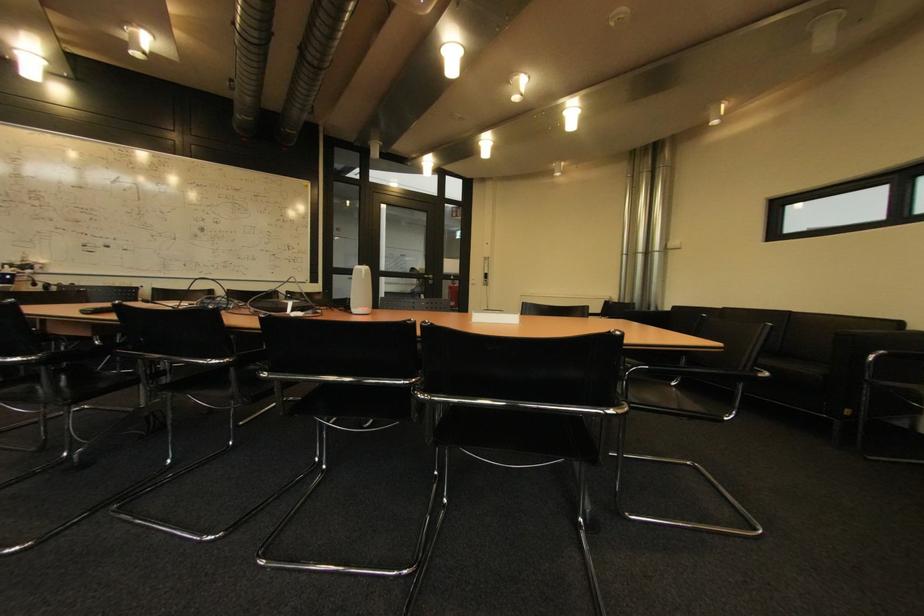
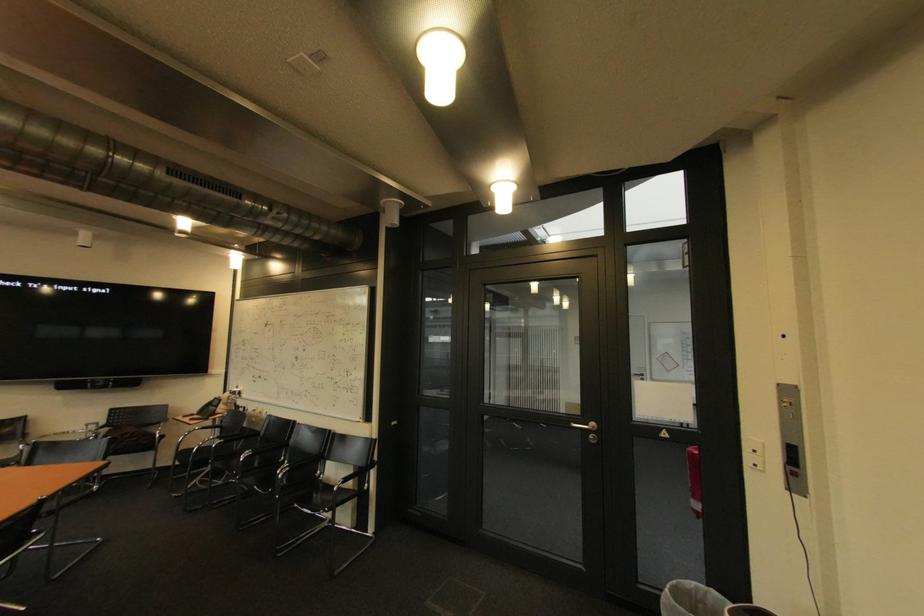
Find the pixel in the second image that matches point 480,283 in the first image.

(757, 459)